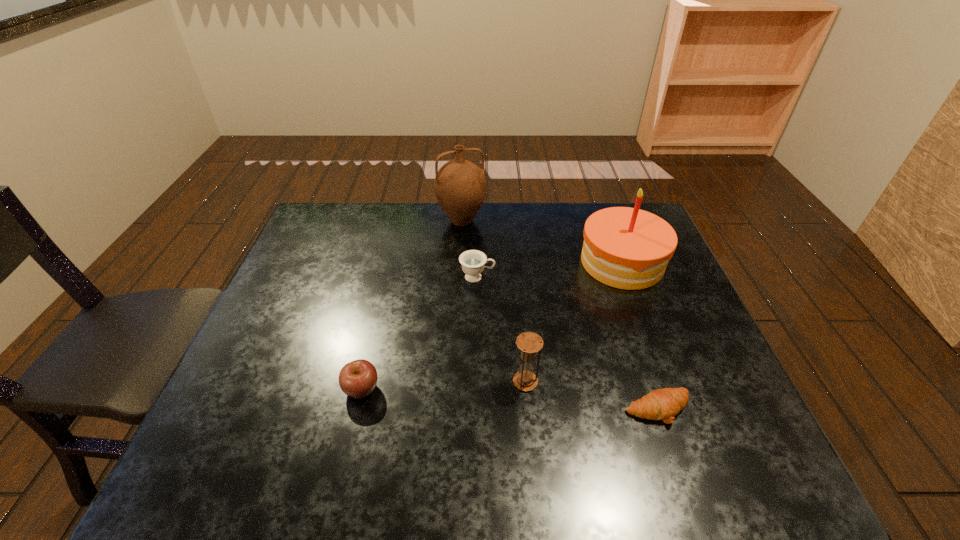
The width and height of the screenshot is (960, 540). In order to click on free space located on the side of the teacup with the handle in this screenshot , I will do (542, 277).

The image size is (960, 540). I want to click on vacant region located on the side of the apple with the unique marking, so click(x=537, y=389).

You are a GUI agent. You are given a task and a screenshot of the screen. Output one action in this format:
    pyautogui.click(x=<x>, y=<y>)
    Task: Click on the vacant point located on the left of the crescent roll
    This screenshot has height=540, width=960.
    Given the screenshot: What is the action you would take?
    pyautogui.click(x=458, y=409)

Find the location of `pitcher that is at the far edge`. pitcher that is at the far edge is located at coordinates (460, 185).

The height and width of the screenshot is (540, 960). I want to click on birthday cake that is at the far edge, so click(628, 248).

You are a GUI agent. You are given a task and a screenshot of the screen. Output one action in this format:
    pyautogui.click(x=<x>, y=<y>)
    Task: Click on the birthday cake located in the right edge section of the desktop
    Image resolution: width=960 pixels, height=540 pixels.
    Given the screenshot: What is the action you would take?
    pyautogui.click(x=628, y=248)

Identify the location of crescent roll located in the right edge section of the desktop. (663, 404).

Where is `object that is at the far right corner`? This screenshot has width=960, height=540. object that is at the far right corner is located at coordinates (628, 248).

Identify the location of vacant space at the far edge of the desktop. (491, 227).

Identify the location of free space at the near edge of the desktop. (410, 471).